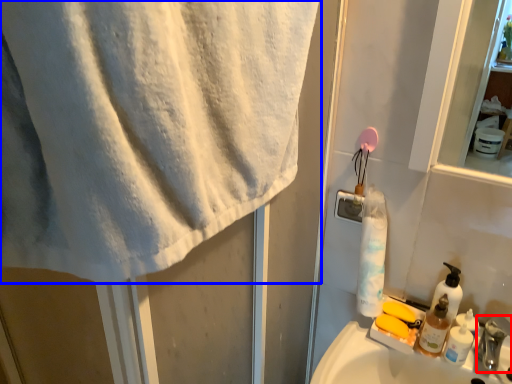
Question: Which object appears farthest to the camera in this image, faucet (highlighted by a red box) or towel (highlighted by a blue box)?

Choices:
 (A) faucet
 (B) towel

Answer: (A)